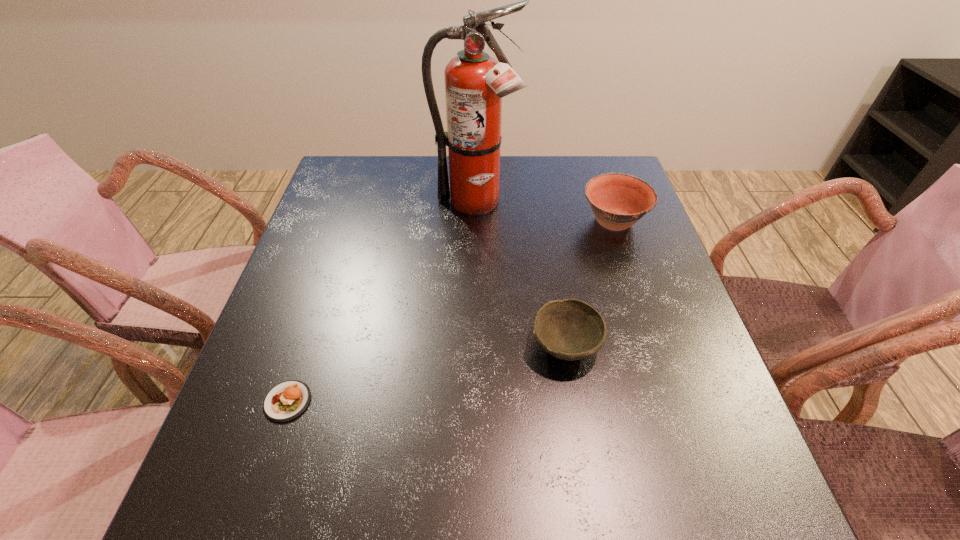
Identify the location of fire extinguisher. (475, 82).

You are a GUI agent. You are given a task and a screenshot of the screen. Output one action in this format:
    pyautogui.click(x=<x>, y=<y>)
    Task: Click on the tallest object
    
    Given the screenshot: What is the action you would take?
    pyautogui.click(x=475, y=82)

The width and height of the screenshot is (960, 540). I want to click on the rightmost object, so click(618, 200).

Locate an element on the screen. This screenshot has height=540, width=960. the taller bowl is located at coordinates (618, 200).

I want to click on the shorter bowl, so click(x=570, y=329).

The width and height of the screenshot is (960, 540). I want to click on the second nearest object, so click(x=570, y=329).

The height and width of the screenshot is (540, 960). I want to click on the leftmost object, so click(286, 401).

You are a GUI agent. You are given a task and a screenshot of the screen. Output one action in this format:
    pyautogui.click(x=<x>, y=<y>)
    Task: Click on the nearest object
    This screenshot has width=960, height=540.
    Given the screenshot: What is the action you would take?
    pyautogui.click(x=286, y=401)

The width and height of the screenshot is (960, 540). What are the coordinates of `free space located from the nozzle of the fire extinguisher` in the screenshot? It's located at (473, 278).

Where is `vacant area located 0.060m on the left of the rightmost object`? This screenshot has width=960, height=540. vacant area located 0.060m on the left of the rightmost object is located at coordinates point(557,222).